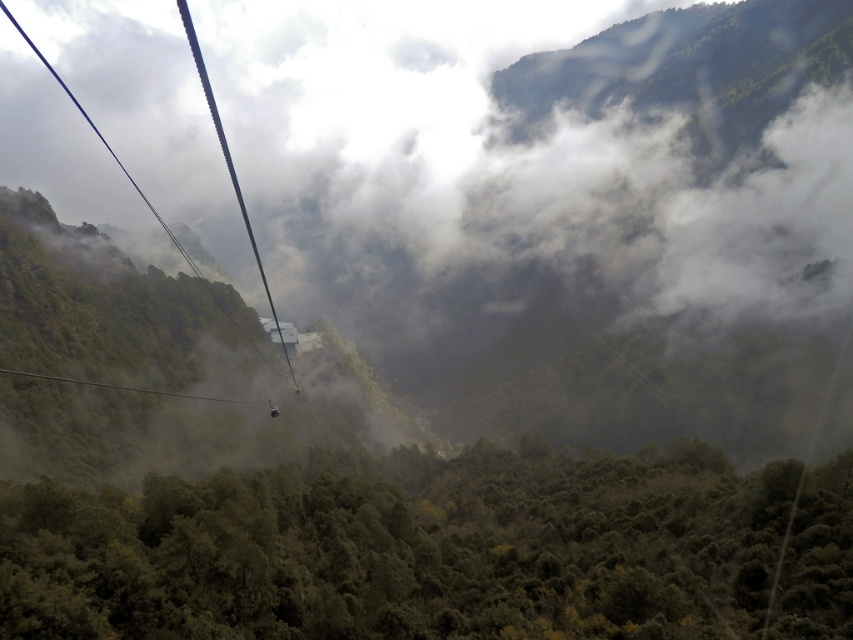
Looking at this image, is white plastic ski lift at left to the left of metallic cable car at center from the viewer's perspective?

Yes, white plastic ski lift at left is to the left of metallic cable car at center.

Is white plastic ski lift at left positioned before metallic cable car at center?

No, white plastic ski lift at left is behind metallic cable car at center.

Image resolution: width=853 pixels, height=640 pixels. Identify the location of white plastic ski lift at left. (231, 170).

Is point (831, 259) positioned in front of point (486, 579)?

No, (831, 259) is behind (486, 579).

Is white fluffy fog at center smaller than green matte forest at lower center?

Actually, white fluffy fog at center might be larger than green matte forest at lower center.

Where is `white fluffy fog at center`? The image size is (853, 640). white fluffy fog at center is located at coordinates (534, 227).

Can you confirm if white fluffy fog at center is positioned to the left of metallic cable car at center?

No, white fluffy fog at center is not to the left of metallic cable car at center.

Based on the photo, does white fluffy fog at center lie in front of metallic cable car at center?

No.

I want to click on white fluffy fog at center, so click(534, 227).